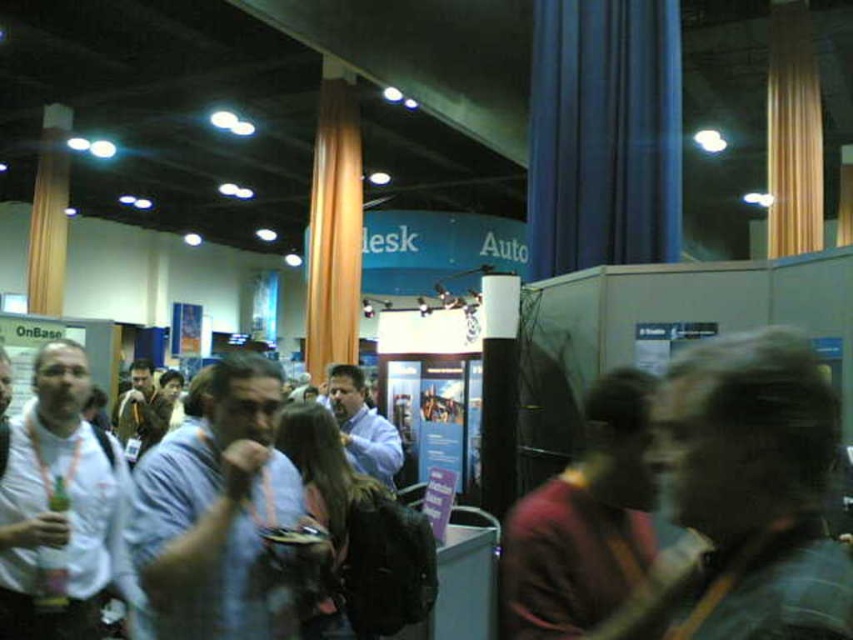
You are standing at the entrance of the event space and want to locate the light blue shirt at center. According to the coordinates given, where should you look relative to the center of the image?

The light blue shirt at center is located at coordinates point 0.800 on the x axis and 0.256 on the y axis, which means it is positioned to the right and slightly below the center of the image.

From the picture: You are at the trade show and need to locate the person wearing the light blue shirt at center. According to the coordinates provided, where would you find them in the image?

The light blue shirt at center is located at point 0.800 on the x axis and 0.256 on the y axis.